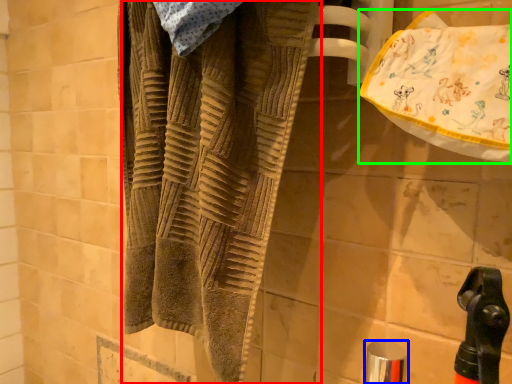
Question: Considering the real-world distances, which object is closest to towel (highlighted by a red box)? faucet (highlighted by a blue box) or beach towel (highlighted by a green box).

Choices:
 (A) faucet
 (B) beach towel

Answer: (B)